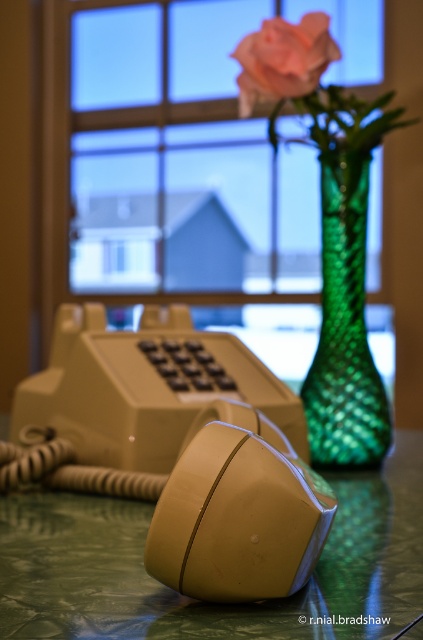
Question: Is transparent glass window at upper center behind beige plastic phone at center?

Choices:
 (A) no
 (B) yes

Answer: (B)

Question: Is transparent glass window at upper center thinner than beige plastic phone at center?

Choices:
 (A) no
 (B) yes

Answer: (A)

Question: Which point is closer to the camera?

Choices:
 (A) (332, 321)
 (B) (291, 48)
 (C) (227, 497)
 (D) (307, 250)

Answer: (C)

Question: Where is beige rubberized mouse at center located in relation to soft pink rose at center in the image?

Choices:
 (A) above
 (B) below

Answer: (B)

Question: Which point is closer to the camera?

Choices:
 (A) beige plastic phone at center
 (B) soft pink rose at center
 (C) beige rubberized mouse at center
 (D) green textured glass vase at center

Answer: (C)

Question: Considering the real-world distances, which object is closest to the beige rubberized mouse at center?

Choices:
 (A) green textured glass vase at center
 (B) transparent glass window at upper center
 (C) soft pink rose at center

Answer: (A)